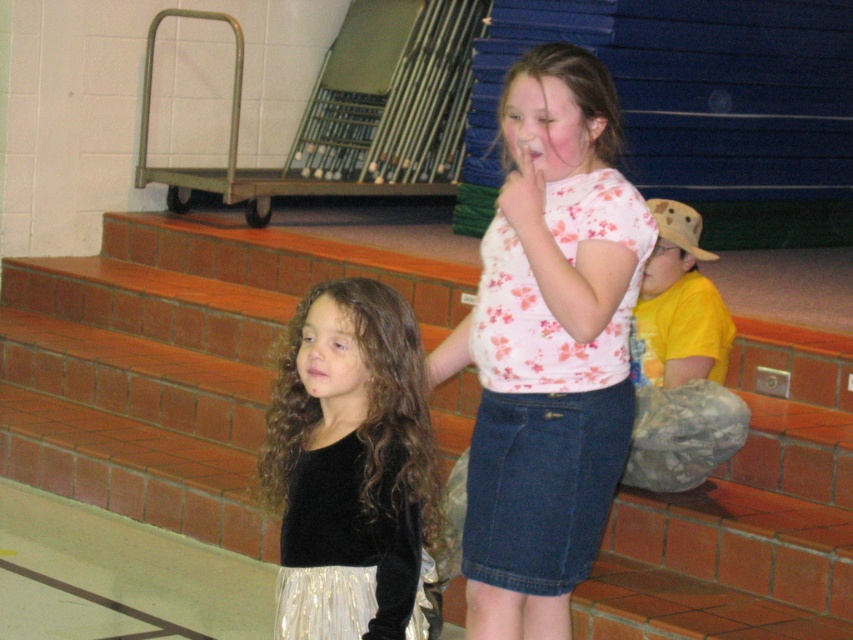
Which is more to the left, brick stairs at center or yellow cotton shirt at right?

From the viewer's perspective, brick stairs at center appears more on the left side.

Between brick stairs at center and yellow cotton shirt at right, which one has less height?

brick stairs at center is shorter.

The width and height of the screenshot is (853, 640). Describe the element at coordinates (172, 362) in the screenshot. I see `brick stairs at center` at that location.

Where is `brick stairs at center`? The image size is (853, 640). brick stairs at center is located at coordinates (172, 362).

Is floral cotton shirt at center to the right of yellow cotton shirt at right from the viewer's perspective?

In fact, floral cotton shirt at center is to the left of yellow cotton shirt at right.

Based on the photo, is floral cotton shirt at center to the left of yellow cotton shirt at right from the viewer's perspective?

Correct, you'll find floral cotton shirt at center to the left of yellow cotton shirt at right.

The width and height of the screenshot is (853, 640). Find the location of `floral cotton shirt at center`. floral cotton shirt at center is located at coordinates 548,346.

This screenshot has height=640, width=853. Find the location of `floral cotton shirt at center`. floral cotton shirt at center is located at coordinates (548, 346).

Which is behind, point (94, 257) or point (512, 637)?

The point (94, 257) is behind.

Who is higher up, brick stairs at center or floral cotton shirt at center?

brick stairs at center

Locate an element on the screen. This screenshot has height=640, width=853. brick stairs at center is located at coordinates (172, 362).